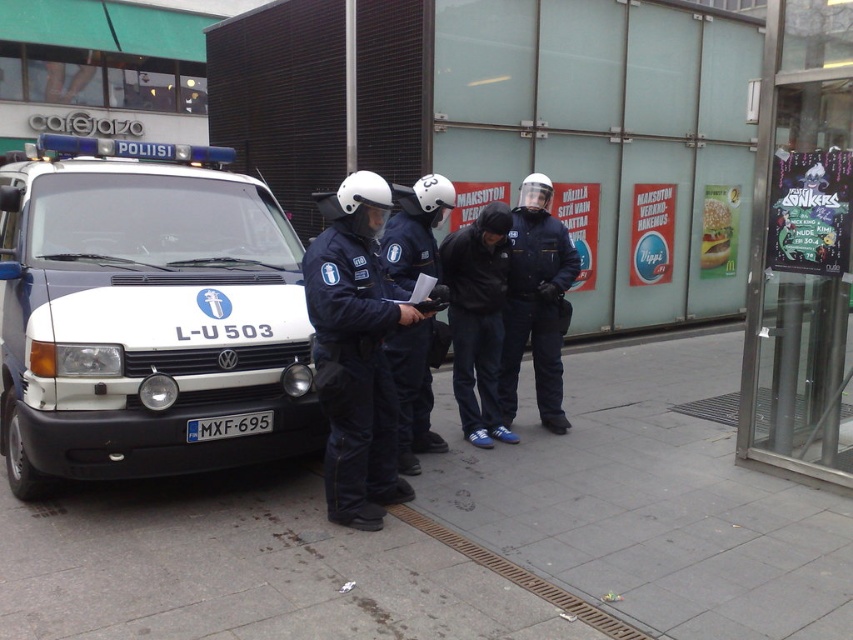
Does matte black uniform at center appear under matte black helmet at center?

Actually, matte black uniform at center is above matte black helmet at center.

Can you confirm if matte black uniform at center is bigger than matte black helmet at center?

Indeed, matte black uniform at center has a larger size compared to matte black helmet at center.

Is point (505, 400) closer to viewer compared to point (409, 429)?

No, (505, 400) is behind (409, 429).

The width and height of the screenshot is (853, 640). What are the coordinates of `matte black uniform at center` in the screenshot? It's located at (537, 301).

Can you confirm if white matte van at left is positioned below navy blue uniform at center?

Incorrect, white matte van at left is not positioned below navy blue uniform at center.

Between white matte van at left and navy blue uniform at center, which one is positioned lower?

Positioned lower is navy blue uniform at center.

Does point (291, 339) come in front of point (314, 300)?

No.

The width and height of the screenshot is (853, 640). I want to click on white matte van at left, so click(144, 314).

Can you confirm if white matte van at left is thinner than black matte jacket at center?

No.

Is point (107, 378) in front of point (469, 280)?

Yes, it is in front of point (469, 280).

I want to click on white matte van at left, so click(x=144, y=314).